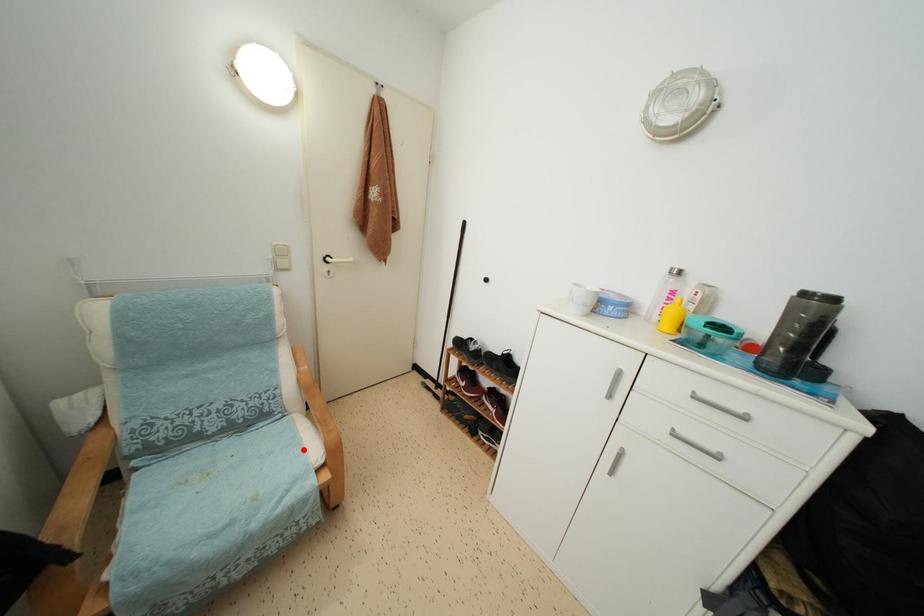
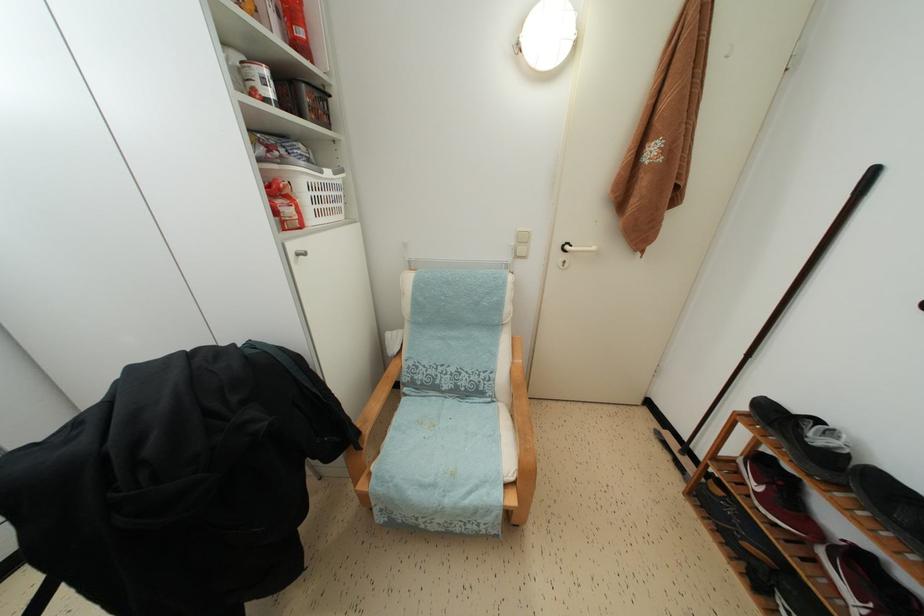
Question: A red point is marked in image1. In image2, is the corresponding 3D point closer to the camera or farther? Reply with the corresponding letter.

Choices:
 (A) The corresponding 3D point is closer.
 (B) The corresponding 3D point is farther.

Answer: (A)